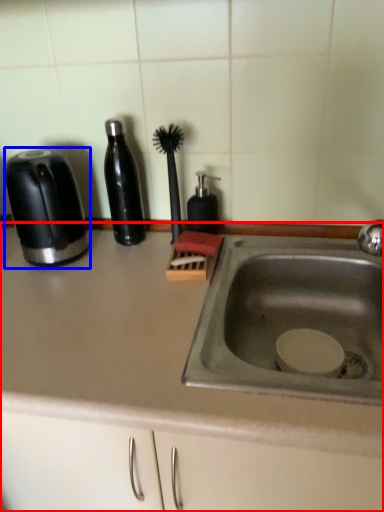
Question: Which point is further to the camera, countertop (highlighted by a red box) or toaster (highlighted by a blue box)?

Choices:
 (A) countertop
 (B) toaster

Answer: (B)